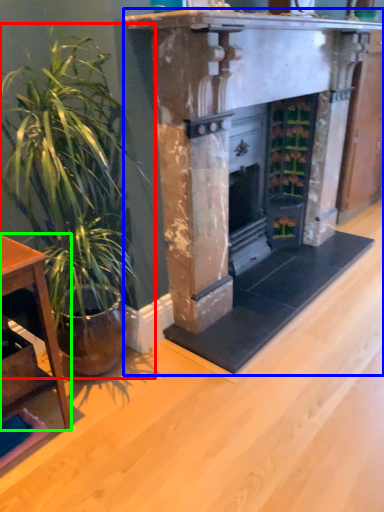
Question: Considering the real-world distances, which object is farthest from houseplant (highlighted by a red box)? fireplace (highlighted by a blue box) or table (highlighted by a green box)?

Choices:
 (A) fireplace
 (B) table

Answer: (A)